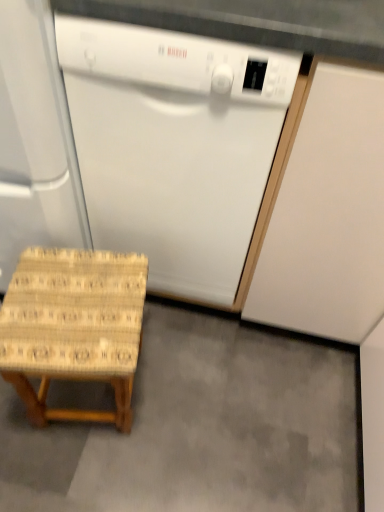
Image resolution: width=384 pixels, height=512 pixels. What do you see at coordinates (200, 426) in the screenshot?
I see `woven wood stool at lower left` at bounding box center [200, 426].

Locate an element on the screen. The image size is (384, 512). woven wood stool at lower left is located at coordinates pyautogui.click(x=200, y=426).

You are a GUI agent. You are given a task and a screenshot of the screen. Output one action in this format:
    pyautogui.click(x=<x>, y=<y>)
    Task: Click on the white glossy dishwasher at center
    The width and height of the screenshot is (384, 512).
    Given the screenshot: What is the action you would take?
    pyautogui.click(x=176, y=146)

I want to click on white matte cabinet at right, so click(x=328, y=215).

Which is more to the right, woven wood stool at lower left or white matte cabinet at right?

From the viewer's perspective, white matte cabinet at right appears more on the right side.

From the image's perspective, would you say woven wood stool at lower left is positioned over white matte cabinet at right?

No, from the image's perspective, woven wood stool at lower left is not over white matte cabinet at right.

Are woven wood stool at lower left and white matte cabinet at right beside each other?

No, woven wood stool at lower left is not in contact with white matte cabinet at right.

Is white glossy dishwasher at center closer to camera compared to white matte cabinet at right?

No, it is not.

Is point (300, 58) behind point (353, 117)?

No, (300, 58) is closer to viewer.

Is white glossy dishwasher at center aimed at white matte cabinet at right?

No, white glossy dishwasher at center does not turn towards white matte cabinet at right.

Would you consider white matte cabinet at right to be distant from woven wood stool at lower left?

No, white matte cabinet at right is in close proximity to woven wood stool at lower left.

Can you confirm if white matte cabinet at right is shorter than woven wood stool at lower left?

No, white matte cabinet at right is not shorter than woven wood stool at lower left.

Considering the positions of points (373, 139) and (89, 402), is point (373, 139) farther from camera compared to point (89, 402)?

No, (373, 139) is closer to viewer.

From a real-world perspective, who is located higher, white glossy dishwasher at center or white matte dishwasher at left?

white matte dishwasher at left.

Consider the image. Is white glossy dishwasher at center not inside white matte dishwasher at left?

Yes.

Can you see white glossy dishwasher at center touching white matte dishwasher at left?

No, white glossy dishwasher at center is not touching white matte dishwasher at left.

Considering the sizes of white glossy dishwasher at center and white matte dishwasher at left in the image, is white glossy dishwasher at center taller or shorter than white matte dishwasher at left?

white glossy dishwasher at center is shorter than white matte dishwasher at left.

Measure the distance from white glossy dishwasher at center to woven wood stool at lower left.

white glossy dishwasher at center and woven wood stool at lower left are 11.61 inches apart.

From a real-world perspective, is white glossy dishwasher at center over woven wood stool at lower left?

Indeed, from a real-world perspective, white glossy dishwasher at center stands above woven wood stool at lower left.

Which object is further away from the camera, white glossy dishwasher at center or woven wood stool at lower left?

woven wood stool at lower left.

Is the surface of white glossy dishwasher at center in direct contact with woven wood stool at lower left?

white glossy dishwasher at center is not next to woven wood stool at lower left, and they're not touching.

Does woven wood stool at lower left have a greater height compared to woven wood stool at lower left?

Correct, woven wood stool at lower left is much taller as woven wood stool at lower left.

Which of these two, woven wood stool at lower left or woven wood stool at lower left, is bigger?

Bigger between the two is woven wood stool at lower left.

From a real-world perspective, which object stands above the other?

woven wood stool at lower left.

Does woven wood stool at lower left have a lesser width compared to woven wood stool at lower left?

Indeed, woven wood stool at lower left has a lesser width compared to woven wood stool at lower left.

In the scene shown: Can you confirm if white matte dishwasher at left is taller than woven wood stool at lower left?

Yes.

Looking at this image, is white matte dishwasher at left wider or thinner than woven wood stool at lower left?

In the image, white matte dishwasher at left appears to be more narrow than woven wood stool at lower left.

From a real-world perspective, which is physically above, white matte dishwasher at left or woven wood stool at lower left?

In real-world perspective, white matte dishwasher at left is above.

Between white matte dishwasher at left and woven wood stool at lower left, which one is positioned behind?

woven wood stool at lower left is behind.

The height and width of the screenshot is (512, 384). Find the location of `cabinetry above the woven wood stool at lower left (from a real-world perspective)`. cabinetry above the woven wood stool at lower left (from a real-world perspective) is located at coordinates (328, 215).

You are a GUI agent. You are given a task and a screenshot of the screen. Output one action in this format:
    pyautogui.click(x=<x>, y=<y>)
    Task: Click on the cabinetry below the white glossy dishwasher at center (from the image's perspective)
    This screenshot has width=384, height=512.
    Given the screenshot: What is the action you would take?
    pyautogui.click(x=328, y=215)

Estimate the real-world distances between objects in this image. Which object is further from white matte dishwasher at left, white matte cabinet at right or woven wood stool at lower left?

Result: Based on the image, woven wood stool at lower left appears to be further to white matte dishwasher at left.

Looking at the image, which one is located further to white matte dishwasher at left, white glossy dishwasher at center or woven wood stool at lower left?

Among the two, woven wood stool at lower left is located further to white matte dishwasher at left.

Which object lies nearer to the anchor point woven wood stool at lower left, white glossy dishwasher at center or woven wood stool at lower left?

Among the two, white glossy dishwasher at center is located nearer to woven wood stool at lower left.

Considering their positions, is white matte dishwasher at left positioned closer to white glossy dishwasher at center than woven wood stool at lower left?

The object closer to white glossy dishwasher at center is white matte dishwasher at left.

Which object lies nearer to the anchor point woven wood stool at lower left, white glossy dishwasher at center or white matte cabinet at right?

white matte cabinet at right is positioned closer to the anchor woven wood stool at lower left.

Estimate the real-world distances between objects in this image. Which object is further from woven wood stool at lower left, white matte dishwasher at left or white matte cabinet at right?

white matte dishwasher at left is positioned further to the anchor woven wood stool at lower left.

Looking at the image, which one is located closer to woven wood stool at lower left, white matte cabinet at right or woven wood stool at lower left?

Among the two, woven wood stool at lower left is located nearer to woven wood stool at lower left.

Considering their positions, is woven wood stool at lower left positioned further to woven wood stool at lower left than white matte dishwasher at left?

Based on the image, woven wood stool at lower left appears to be further to woven wood stool at lower left.

Locate an element on the screen. The image size is (384, 512). home appliance situated between woven wood stool at lower left and white matte cabinet at right from left to right is located at coordinates (176, 146).

Locate an element on the screen. stool between white matte dishwasher at left and white matte cabinet at right in the horizontal direction is located at coordinates (73, 327).

Identify the location of concrete between woven wood stool at lower left and white matte cabinet at right from left to right. (200, 426).

Where is `concrete between white matte dishwasher at left and white matte cabinet at right from left to right`? concrete between white matte dishwasher at left and white matte cabinet at right from left to right is located at coordinates (200, 426).